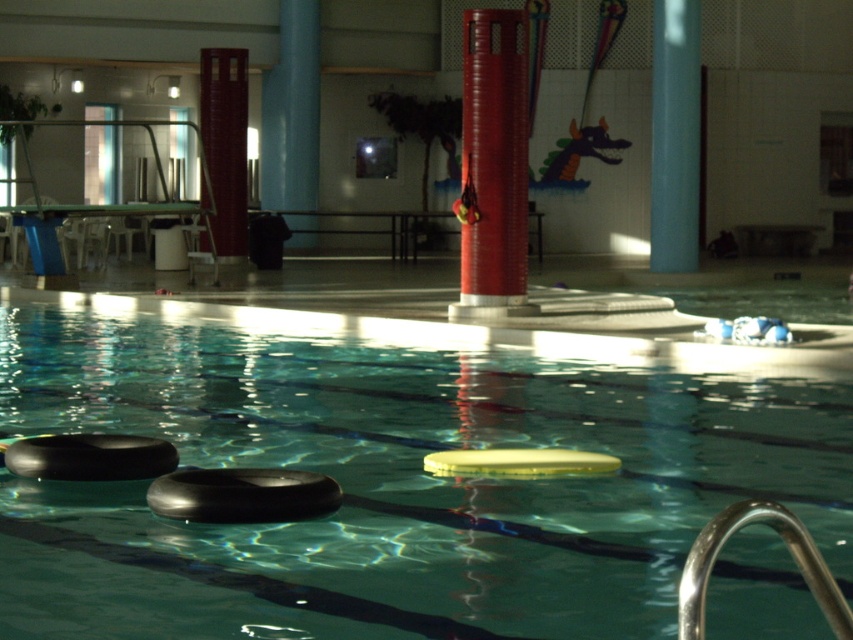
You are a swimmer who wants to reach the red matte column at center from the black rubber tire at center. Which object is closer to the edge of the pool?

The black rubber tire at center is closer to the edge of the pool because the red matte column at center is taller than it, indicating it is further away from the edge.